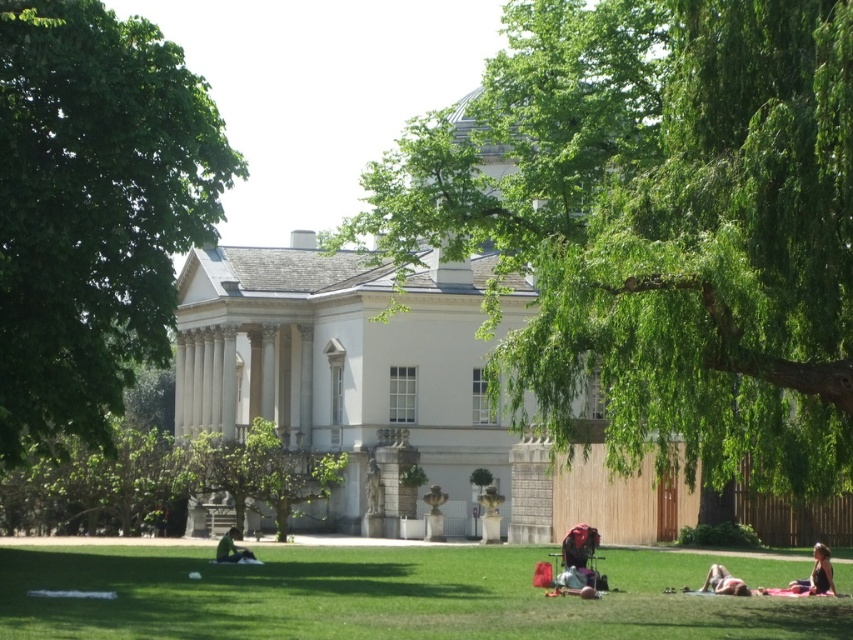
Question: Which of the following is the farthest from the observer?

Choices:
 (A) green fabric person at lower left
 (B) green leafy tree at left

Answer: (A)

Question: Does green grass at lower center have a greater width compared to black fabric person at lower right?

Choices:
 (A) yes
 (B) no

Answer: (A)

Question: Can you confirm if green leafy tree at center is smaller than black fabric person at lower right?

Choices:
 (A) yes
 (B) no

Answer: (B)

Question: Which point is closer to the camera?

Choices:
 (A) green leafy tree at center
 (B) green leafy tree at left
 (C) green fabric person at lower left
 (D) skinny jeans at lower right

Answer: (A)

Question: Is green leafy tree at left wider than black fabric person at lower right?

Choices:
 (A) no
 (B) yes

Answer: (B)

Question: Which point is farther from the camera taking this photo?

Choices:
 (A) (239, 552)
 (B) (51, 324)
 (C) (727, 570)
 (D) (798, 586)

Answer: (A)